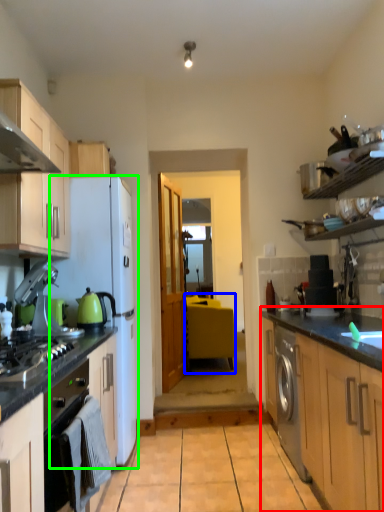
Question: Estimate the real-world distances between objects in this image. Which object is closer to counter (highlighted by a red box), table (highlighted by a blue box) or refrigerator (highlighted by a green box)?

Choices:
 (A) table
 (B) refrigerator

Answer: (B)